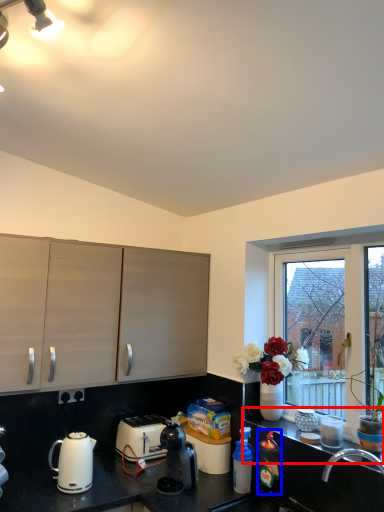
Question: Among these objects, which one is nearest to the camera, window sill (highlighted by a red box) or bottle (highlighted by a blue box)?

Choices:
 (A) window sill
 (B) bottle

Answer: (A)